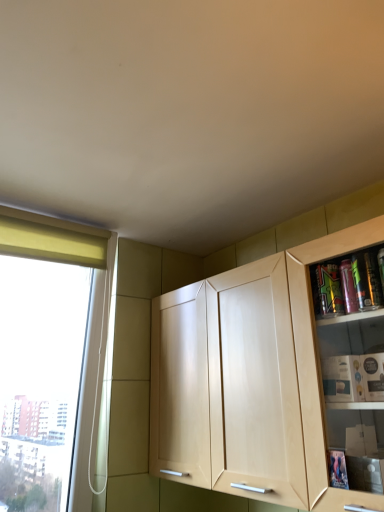
What do you see at coordinates (249, 381) in the screenshot?
I see `light wood cabinet at center` at bounding box center [249, 381].

Measure the distance between light wood cabinet at center and camera.

The distance of light wood cabinet at center from camera is 95.00 centimeters.

In order to click on light wood cabinet at center in this screenshot , I will do `click(249, 381)`.

Where is `light wood cabinet at center`? light wood cabinet at center is located at coordinates (249, 381).